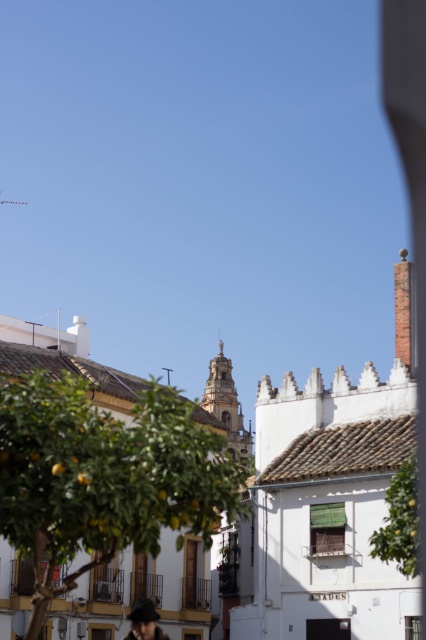
Question: Which object appears farthest from the camera in this image?

Choices:
 (A) golden stone tower at center
 (B) matte black hat at lower center
 (C) white textured building at center

Answer: (A)

Question: Which point is closer to the camera?

Choices:
 (A) (46, 456)
 (B) (58, 358)
 (C) (143, 637)
 (D) (249, 440)

Answer: (A)

Question: From the image, what is the correct spatial relationship of white textured building at center in relation to golden stone tower at center?

Choices:
 (A) right
 (B) left

Answer: (A)

Question: Does golden stone tower at center have a greater width compared to matte black hat at lower center?

Choices:
 (A) yes
 (B) no

Answer: (A)

Question: Which point is closer to the camera taking this photo?

Choices:
 (A) (135, 621)
 (B) (305, 408)
 (C) (236, 442)
 (D) (198, 509)

Answer: (D)

Question: Is green leafy tree at center closer to the viewer compared to golden stone tower at center?

Choices:
 (A) yes
 (B) no

Answer: (A)